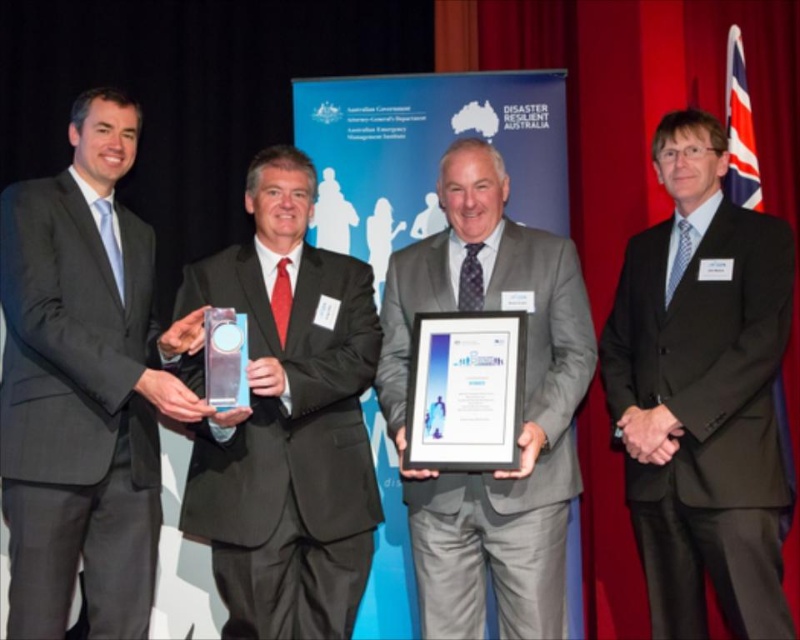
You are attending an event where two men in black suits are standing in front of the Disaster Resilient Australia backdrop. The man on the left holds an award. Which man is closer to you, the black suit at left or the matte black suit at center?

The black suit at left is closer to you because he is in front of the matte black suit at center.

You are standing in front of the Disaster Resilient Australia backdrop. There are two points marked on the image. The first point is at coordinates point (784, 230) and the second point is at point (368, 273). Which point is closer to you?

Point (784, 230) is in front of point (368, 273), so it is closer to you.

You are attending an event at Disaster Resilient Australia and notice two men in the image. One is wearing a black suit at left and the other is standing somewhere else. Based on their positions, can you determine which man is closer to the Disaster Resilient Australia logo on the backdrop?

The black suit at left is located at point (x=82, y=387), which is closer to the Disaster Resilient Australia logo on the backdrop compared to the other man, so the man in the black suit at left is closer.